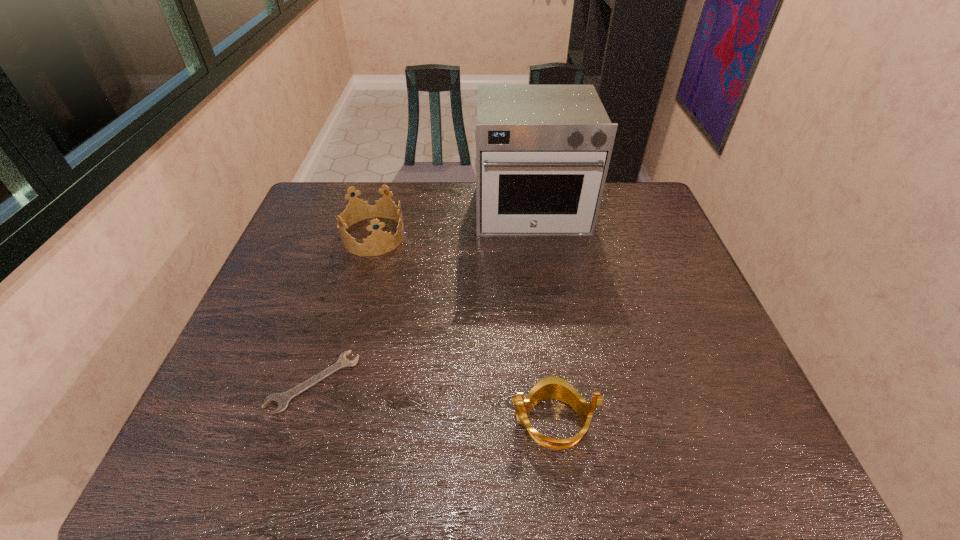
Identify the location of vacant space that satisfies the following two spatial constraints: 1. on the front-facing side of the taller tiara; 2. on the front side of the wrench. This screenshot has height=540, width=960. (332, 382).